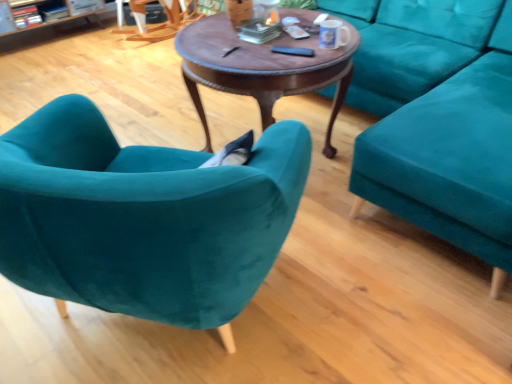
Question: Relative to wooden rocking chair at upper left, is white plastic remote control at center, arranged as the first remote control when viewed from the back, in front or behind?

Choices:
 (A) front
 (B) behind

Answer: (A)

Question: Is white plastic remote control at center, arranged as the first remote control when viewed from the back, bigger or smaller than wooden rocking chair at upper left?

Choices:
 (A) big
 (B) small

Answer: (B)

Question: Which of these objects is positioned closest to the black matte remote control at center, arranged as the first remote control when ordered from the bottom?

Choices:
 (A) velvet teal armchair at left
 (B) wooden rocking chair at upper left
 (C) teal velvet couch at right
 (D) white plastic remote control at center, arranged as the first remote control when viewed from the back
 (E) white glossy mug at upper center

Answer: (E)

Question: Considering the real-world distances, which object is closest to the wooden rocking chair at upper left?

Choices:
 (A) black matte remote control at center, arranged as the first remote control when ordered from the bottom
 (B) white plastic remote control at center, which appears as the first remote control when viewed from the top
 (C) teal velvet couch at right
 (D) velvet teal armchair at left
 (E) white glossy mug at upper center

Answer: (B)